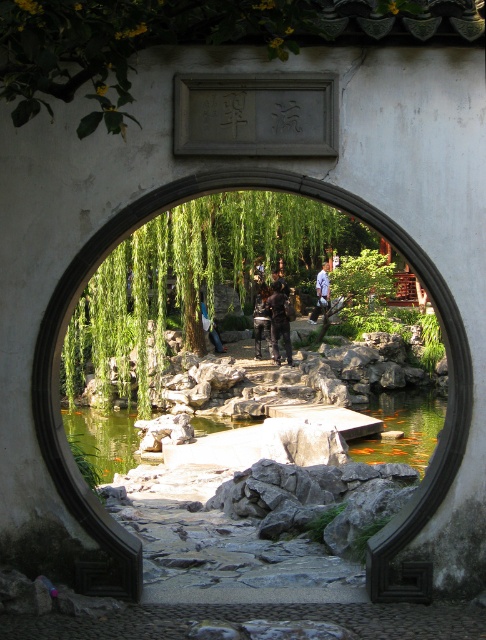
Looking at this image, you are a visitor in this garden and want to place both the light brown leather jacket at center and the dark blue uniform at center on a bench that can only hold items up to the width of the wider item. Which item should you place first to ensure both fit?

The light brown leather jacket at center is wider than the dark blue uniform at center. Place the light brown leather jacket at center first to ensure it fits, then the dark blue uniform at center will also fit since it is narrower.

You are standing in the garden and see both the denim jacket at center and the dark blue uniform at center. Which one is taller?

The denim jacket at center is taller than the dark blue uniform at center.